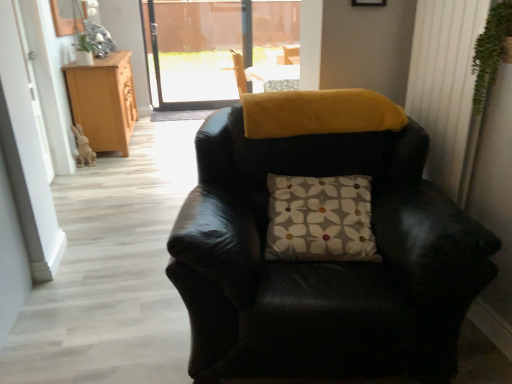
Question: Considering the relative positions of white textured curtain at right and green leafy plant at upper right in the image provided, is white textured curtain at right to the left or to the right of green leafy plant at upper right?

Choices:
 (A) right
 (B) left

Answer: (A)

Question: Considering the positions of point (482, 3) and point (477, 74), is point (482, 3) closer or farther from the camera than point (477, 74)?

Choices:
 (A) closer
 (B) farther

Answer: (A)

Question: Based on their relative distances, which object is farther from the floral-patterned fabric pillow at center?

Choices:
 (A) black leather chair at center
 (B) green leafy plant at upper right
 (C) light brown wood cabinet at left
 (D) white textured curtain at right

Answer: (C)

Question: Which object is the farthest from the white textured curtain at right?

Choices:
 (A) light brown wood cabinet at left
 (B) green leafy plant at upper right
 (C) floral-patterned fabric pillow at center
 (D) black leather chair at center

Answer: (A)